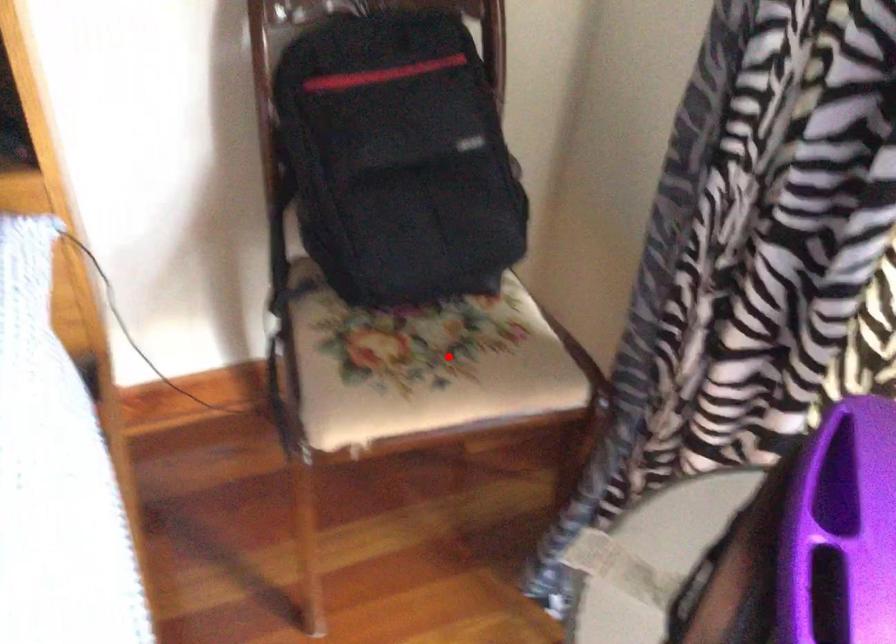
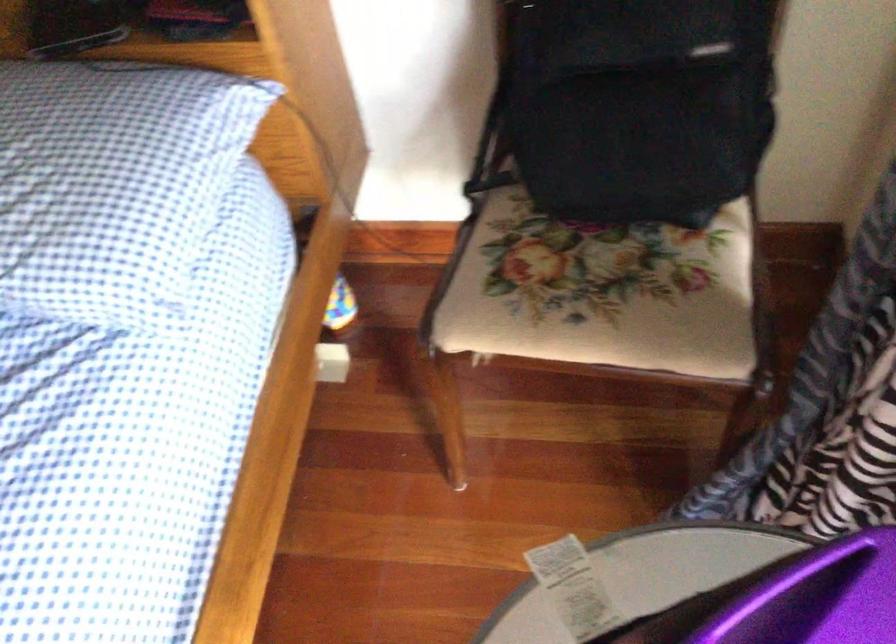
In the second image, find the point that corresponds to the highlighted location in the first image.

(599, 292)